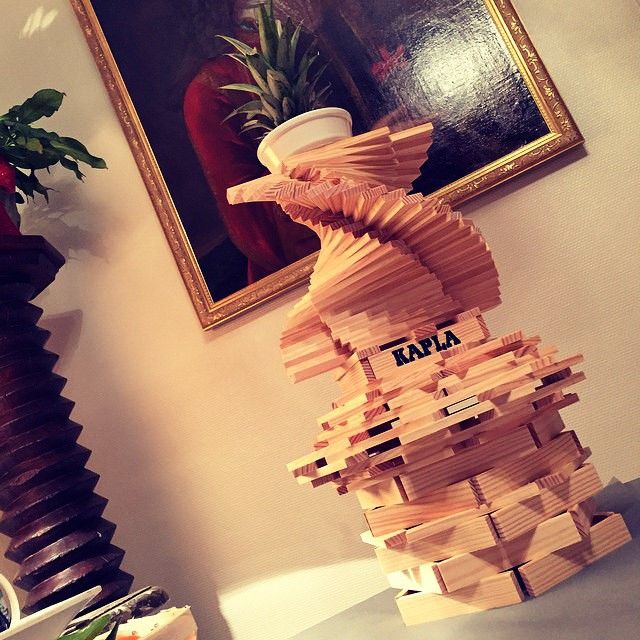
The width and height of the screenshot is (640, 640). I want to click on table, so click(x=356, y=624).